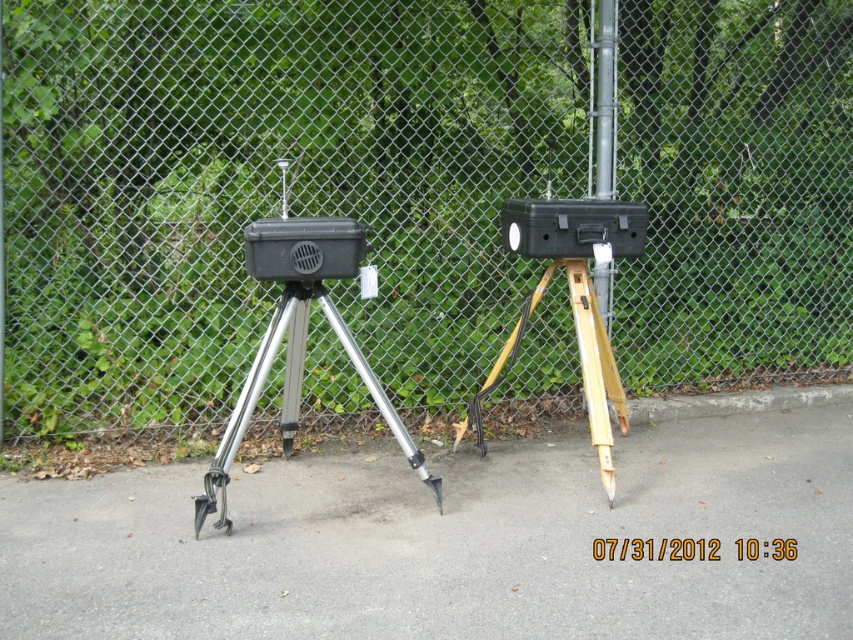
Can you confirm if metal mesh fence at center is thinner than gray asphalt pavement at center?

No, metal mesh fence at center is not thinner than gray asphalt pavement at center.

Is metal mesh fence at center behind gray asphalt pavement at center?

Yes.

This screenshot has height=640, width=853. What do you see at coordinates (268, 188) in the screenshot?
I see `metal mesh fence at center` at bounding box center [268, 188].

Find the location of `metal mesh fence at center`. metal mesh fence at center is located at coordinates (268, 188).

Is metal mesh fence at center to the left of wooden tripod at center from the viewer's perspective?

Indeed, metal mesh fence at center is positioned on the left side of wooden tripod at center.

Which is behind, point (445, 154) or point (512, 339)?

Point (445, 154)

Find the location of `metal mesh fence at center`. metal mesh fence at center is located at coordinates tap(268, 188).

Is gray asphalt pavement at center positioned at the back of silver metallic tripod at center?

No, it is in front of silver metallic tripod at center.

Does gray asphalt pavement at center come in front of silver metallic tripod at center?

Yes, it is.

Who is more distant from viewer, (102, 632) or (219, 474)?

The point (219, 474) is more distant.

Locate an element on the screen. The image size is (853, 640). gray asphalt pavement at center is located at coordinates (457, 540).